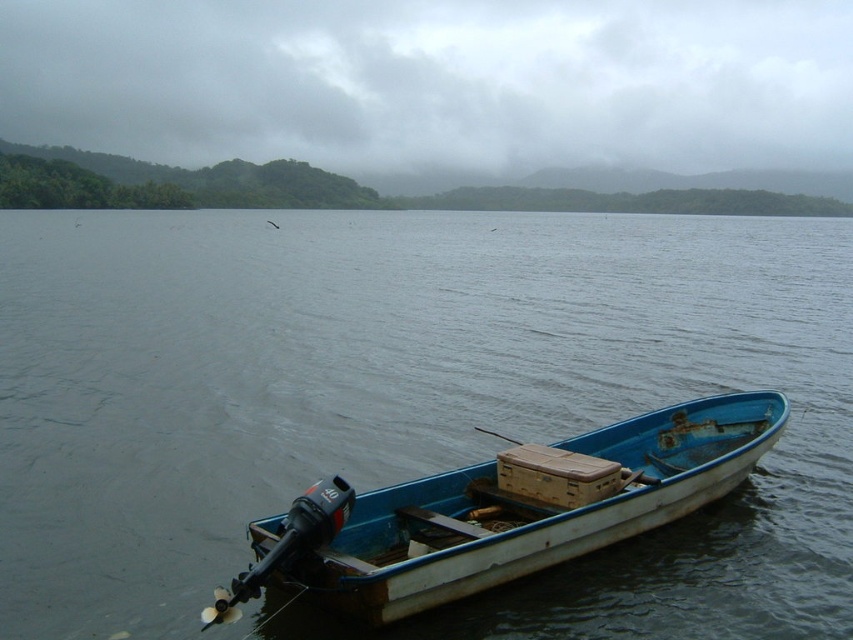
Question: Can you confirm if blue wooden boat at center is wider than blue wooden boat at lower right?

Choices:
 (A) no
 (B) yes

Answer: (B)

Question: Is blue wooden boat at center positioned before blue wooden boat at lower right?

Choices:
 (A) no
 (B) yes

Answer: (A)

Question: Which point is farther to the camera?

Choices:
 (A) blue wooden boat at lower right
 (B) blue wooden boat at center

Answer: (B)

Question: Does blue wooden boat at center come in front of blue wooden boat at lower right?

Choices:
 (A) yes
 (B) no

Answer: (B)